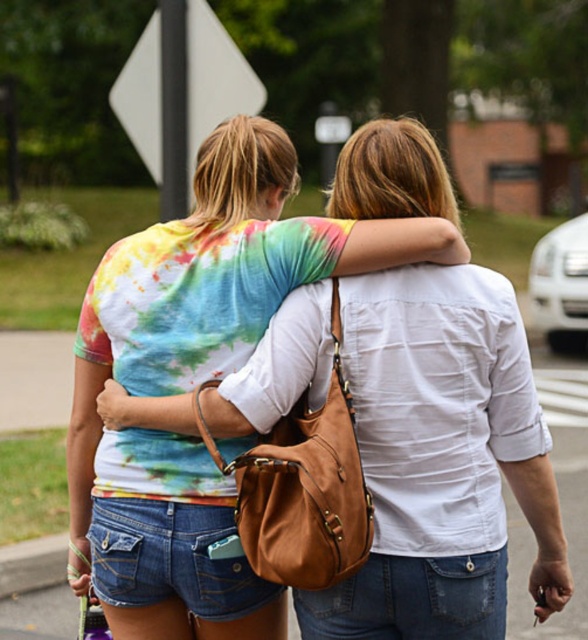
Who is shorter, tie-dye fabric shirt at center or white plastic sign at upper center?

With less height is white plastic sign at upper center.

Between tie-dye fabric shirt at center and white plastic sign at upper center, which one is positioned higher?

Positioned higher is white plastic sign at upper center.

You are a GUI agent. You are given a task and a screenshot of the screen. Output one action in this format:
    pyautogui.click(x=<x>, y=<y>)
    Task: Click on the tie-dye fabric shirt at center
    
    Given the screenshot: What is the action you would take?
    pyautogui.click(x=441, y=460)

Where is `tie-dye fabric shirt at center`? tie-dye fabric shirt at center is located at coordinates (441, 460).